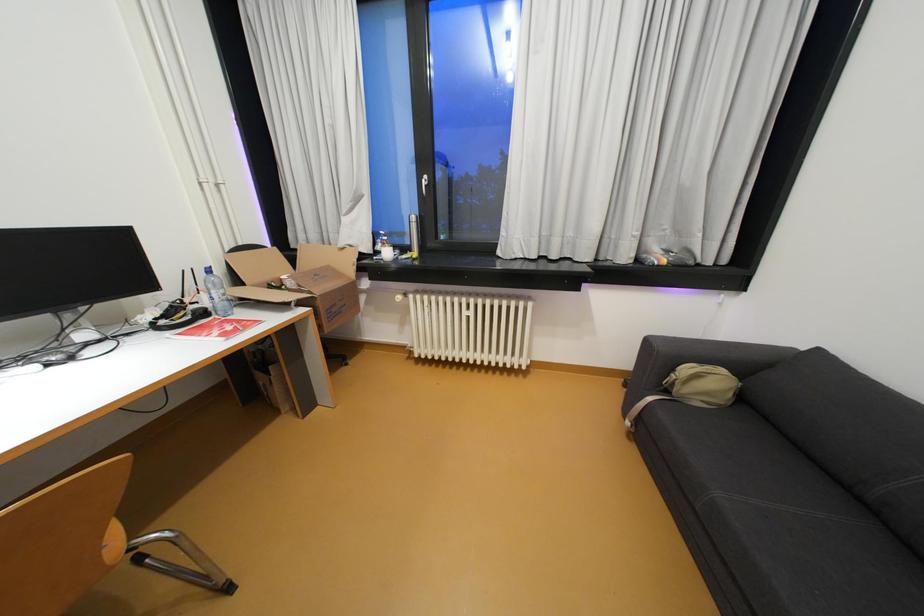
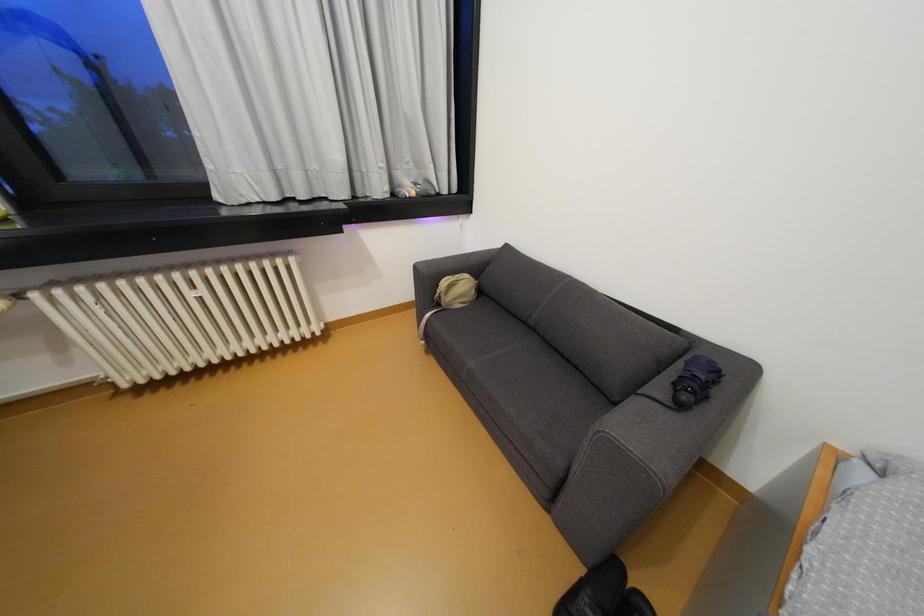
Question: The images are taken continuously from a first-person perspective. In which direction is your viewpoint rotating?

Choices:
 (A) Left
 (B) Right
 (C) Up
 (D) Down

Answer: (B)